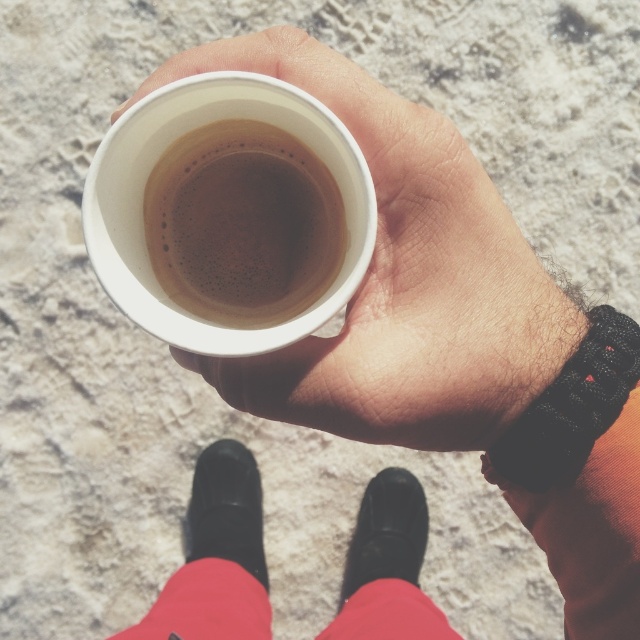
Question: Is red cotton sock at lower center behind black leather shoe at lower center?

Choices:
 (A) yes
 (B) no

Answer: (B)

Question: Estimate the real-world distances between objects in this image. Which object is closer to the brown matte cup at center?

Choices:
 (A) black knitted sock at lower right
 (B) red cotton sock at lower center
 (C) white matte cup at center

Answer: (C)

Question: Among these points, which one is nearest to the camera?

Choices:
 (A) pyautogui.click(x=513, y=305)
 (B) pyautogui.click(x=196, y=593)
 (C) pyautogui.click(x=360, y=548)
 (D) pyautogui.click(x=225, y=532)

Answer: (A)

Question: Which of these objects is positioned closest to the red cotton sock at lower center?

Choices:
 (A) black knitted sock at lower right
 (B) black leather shoe at lower center
 (C) white matte cup at center

Answer: (B)

Question: Where is black leather boot at lower center located in relation to black leather shoe at lower center in the image?

Choices:
 (A) above
 (B) below

Answer: (A)

Question: Is brown matte cup at center further to the viewer compared to black leather shoe at lower center?

Choices:
 (A) yes
 (B) no

Answer: (B)